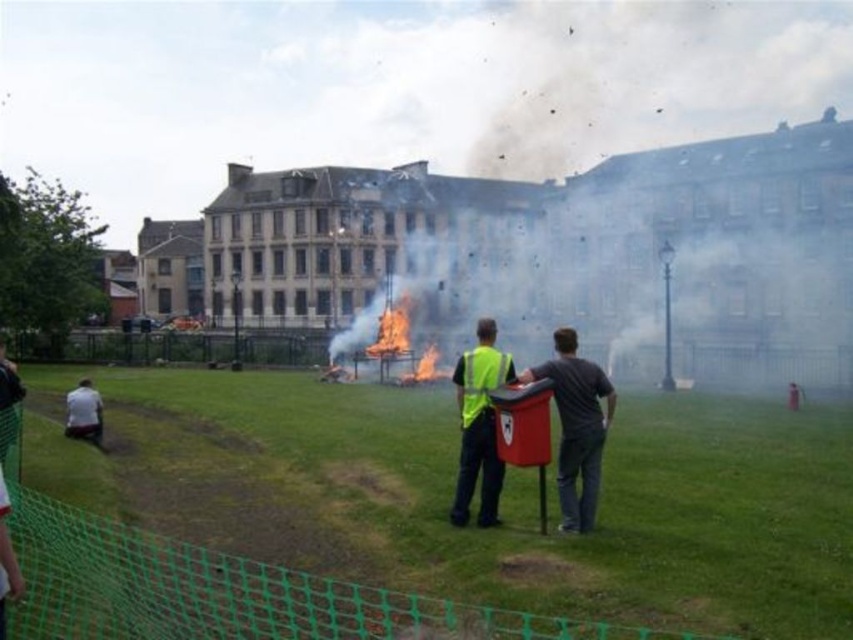
I want to click on white smoke at center, so click(x=695, y=198).

Between white smoke at center and dark gray fabric shirt at center, which one appears on the right side from the viewer's perspective?

white smoke at center

Between point (720, 385) and point (578, 499), which one is positioned in front?

Point (578, 499) is more forward.

You are a GUI agent. You are given a task and a screenshot of the screen. Output one action in this format:
    pyautogui.click(x=<x>, y=<y>)
    Task: Click on the white smoke at center
    
    Given the screenshot: What is the action you would take?
    pyautogui.click(x=695, y=198)

Who is taller, dark gray fabric shirt at center or yellow reflective vest at center?

yellow reflective vest at center is taller.

Between point (535, 365) and point (479, 376), which one is positioned in front?

Point (479, 376)

Locate an element on the screen. This screenshot has height=640, width=853. dark gray fabric shirt at center is located at coordinates (576, 426).

In the scene shown: Does yellow reflective vest at center have a smaller size compared to flamematerial/texturefire at center?

No.

Does yellow reflective vest at center appear on the right side of flamematerial/texturefire at center?

Yes, yellow reflective vest at center is to the right of flamematerial/texturefire at center.

Identify the location of yellow reflective vest at center. The width and height of the screenshot is (853, 640). (479, 424).

The image size is (853, 640). Find the location of `yellow reflective vest at center`. yellow reflective vest at center is located at coordinates click(x=479, y=424).